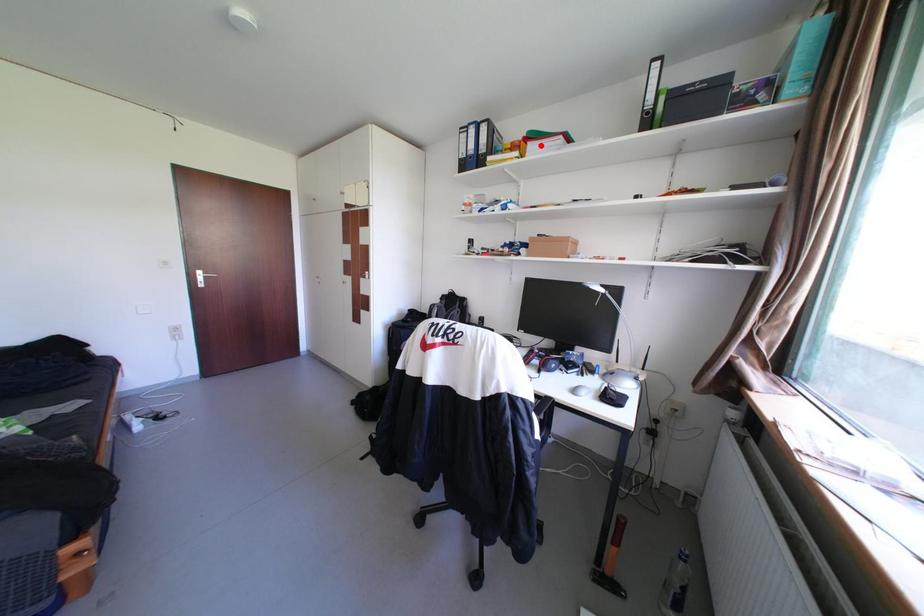
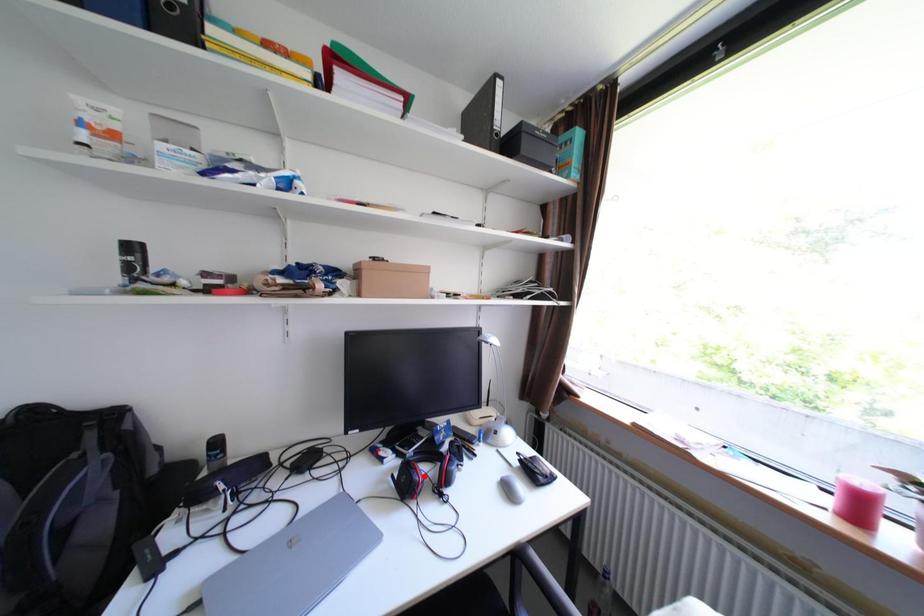
I am providing you with two images of the same scene from different viewpoints. A red point is marked on the first image and another point is marked on the second image. Does the point marked in image1 correspond to the same location as the one in image2?

No